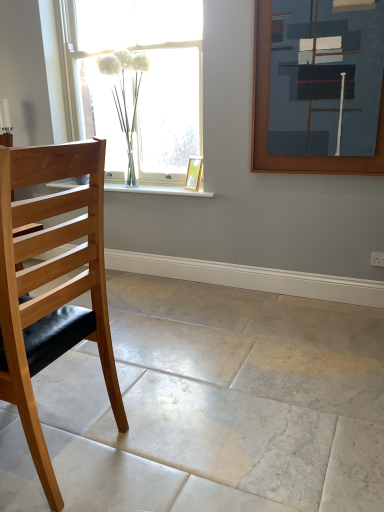
Question: From the image's perspective, would you say gold metallic picture frame at window, the 1th picture frame in the left-to-right sequence, is shown under light wood/black leather chair at left?

Choices:
 (A) yes
 (B) no

Answer: (B)

Question: Is light wood/black leather chair at left completely or partially inside gold metallic picture frame at window, arranged as the first picture frame when viewed from the back?

Choices:
 (A) no
 (B) yes

Answer: (A)

Question: From the image's perspective, is gold metallic picture frame at window, acting as the second picture frame starting from the front, on light wood/black leather chair at left?

Choices:
 (A) no
 (B) yes

Answer: (B)

Question: Considering the relative sizes of gold metallic picture frame at window, acting as the second picture frame starting from the front, and light wood/black leather chair at left in the image provided, is gold metallic picture frame at window, acting as the second picture frame starting from the front, bigger than light wood/black leather chair at left?

Choices:
 (A) yes
 (B) no

Answer: (B)

Question: Is gold metallic picture frame at window, marked as the second picture frame in a right-to-left arrangement, to the right of light wood/black leather chair at left from the viewer's perspective?

Choices:
 (A) no
 (B) yes

Answer: (B)

Question: Based on their positions, is white marble floor at lower left located to the left or right of light wood/black leather chair at left?

Choices:
 (A) left
 (B) right

Answer: (B)

Question: In terms of size, does white marble floor at lower left appear bigger or smaller than light wood/black leather chair at left?

Choices:
 (A) big
 (B) small

Answer: (A)

Question: Is point (61, 373) closer or farther from the camera than point (94, 173)?

Choices:
 (A) closer
 (B) farther

Answer: (B)

Question: From the image's perspective, is white marble floor at lower left positioned above or below light wood/black leather chair at left?

Choices:
 (A) below
 (B) above

Answer: (A)

Question: Does point (187, 195) appear closer or farther from the camera than point (269, 346)?

Choices:
 (A) farther
 (B) closer

Answer: (A)

Question: From the image's perspective, is white marble window sill at center positioned above or below white marble floor at lower left?

Choices:
 (A) above
 (B) below

Answer: (A)

Question: In the image, is white marble window sill at center positioned in front of or behind white marble floor at lower left?

Choices:
 (A) behind
 (B) front

Answer: (A)

Question: Is white marble window sill at center wider or thinner than white marble floor at lower left?

Choices:
 (A) wide
 (B) thin

Answer: (B)

Question: In the image, is white glass vase at upper center positioned in front of or behind gold metallic picture frame at window, arranged as the first picture frame when viewed from the back?

Choices:
 (A) behind
 (B) front

Answer: (B)

Question: From their relative heights in the image, would you say white glass vase at upper center is taller or shorter than gold metallic picture frame at window, acting as the second picture frame starting from the front?

Choices:
 (A) tall
 (B) short

Answer: (A)